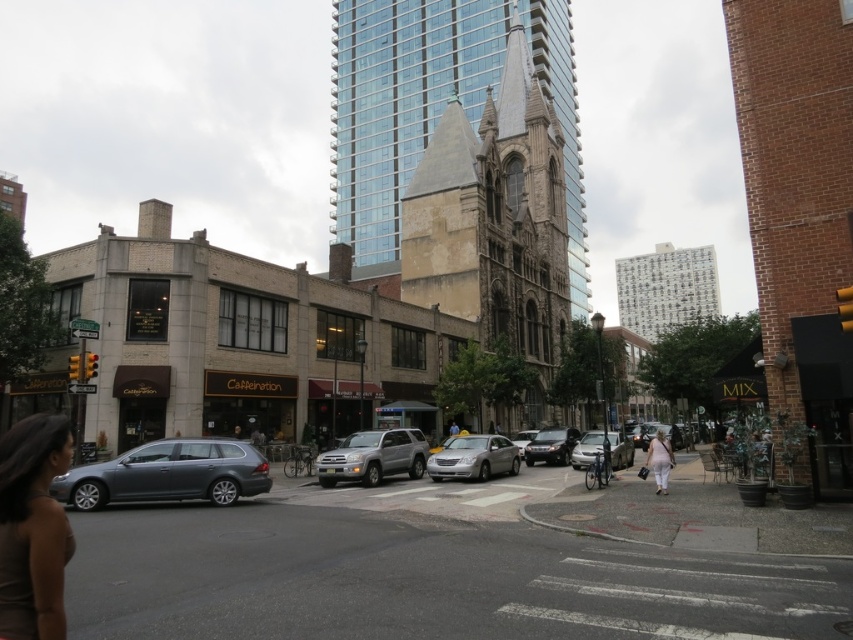
You are standing at the point marked by the coordinates point (167, 474) in the image. What object is located at this position?

The point (167, 474) corresponds to the metallic gray station wagon at lower left.

You are a photographer standing at the camera position in the scene. You want to take a clear photo of the satin silver sedan at center. Considering the distance, can you capture it without zooming in?

The satin silver sedan at center is 51.54 meters away from the camera. At this distance, capturing a clear photo without zooming in may be challenging as the sedan would appear small in the frame. Using zoom would help magnify the subject for clarity.

You are standing at the pedestrian crossing marked by white lines on the asphalt road, and you want to walk directly towards the glassy steel tower at center. In which direction should you walk?

You should walk towards the center of the image, where the glassy steel tower at center is located at point coordinates of 0.255 on the x axis and 0.544 on the y axis.